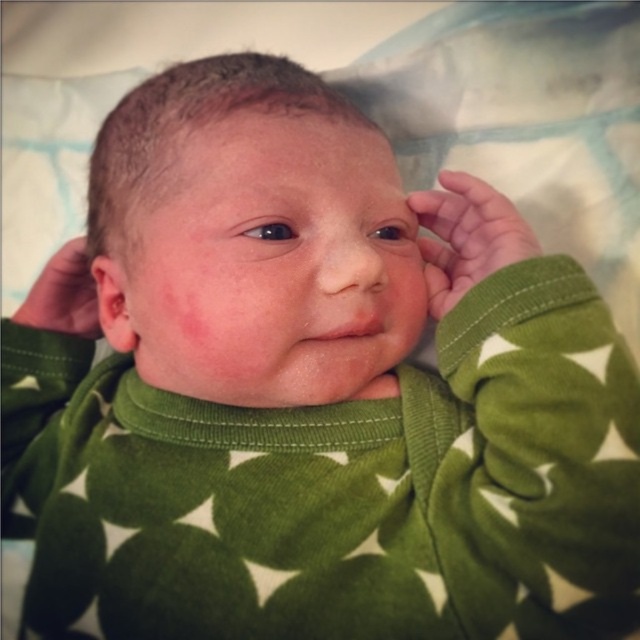
Question: Estimate the real-world distances between objects in this image. Which object is closer to the skinny green fabric at left?

Choices:
 (A) pinkish skin ear at left
 (B) green soft fabric hand at upper right

Answer: (A)

Question: Does green soft fabric hand at upper right appear over pinkish skin ear at left?

Choices:
 (A) yes
 (B) no

Answer: (A)

Question: Which point is farther to the camera?

Choices:
 (A) (42, 316)
 (B) (429, 305)
 (C) (106, 272)

Answer: (A)

Question: Considering the real-world distances, which object is farthest from the skinny green fabric at left?

Choices:
 (A) green soft fabric hand at upper right
 (B) pinkish skin ear at left

Answer: (A)

Question: Is green soft fabric hand at upper right to the right of skinny green fabric at left from the viewer's perspective?

Choices:
 (A) no
 (B) yes

Answer: (B)

Question: Can you confirm if skinny green fabric at left is bigger than pinkish skin ear at left?

Choices:
 (A) yes
 (B) no

Answer: (B)